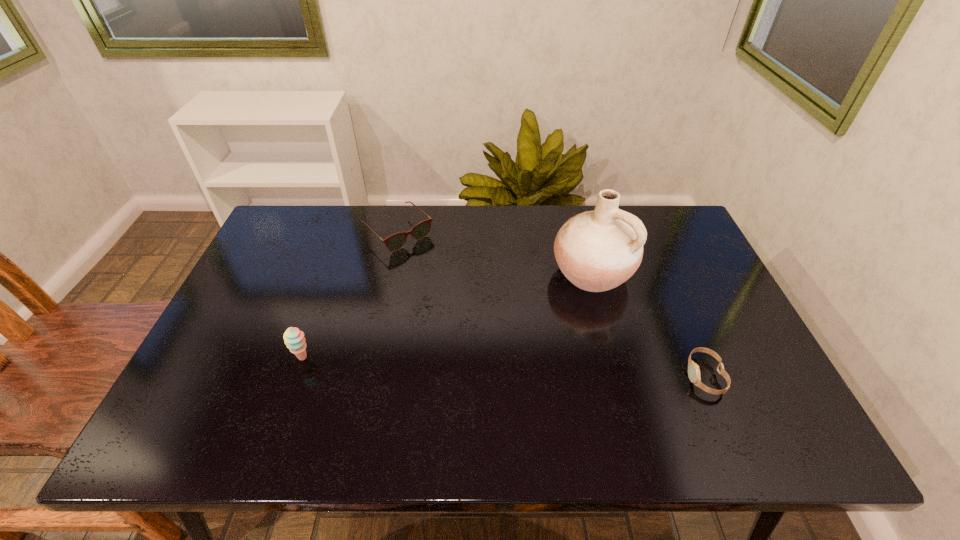
The height and width of the screenshot is (540, 960). In order to click on object that is the closest one to the third shortest object in this screenshot , I will do `click(395, 242)`.

Identify the location of vacant space that satisfies the following two spatial constraints: 1. on the front side of the watch; 2. on the face of the third object from right to left. The height and width of the screenshot is (540, 960). (368, 376).

Where is `free spot that satisfies the following two spatial constraints: 1. on the front side of the spectacles; 2. on the face of the shortest object`? This screenshot has height=540, width=960. free spot that satisfies the following two spatial constraints: 1. on the front side of the spectacles; 2. on the face of the shortest object is located at coordinates (368, 376).